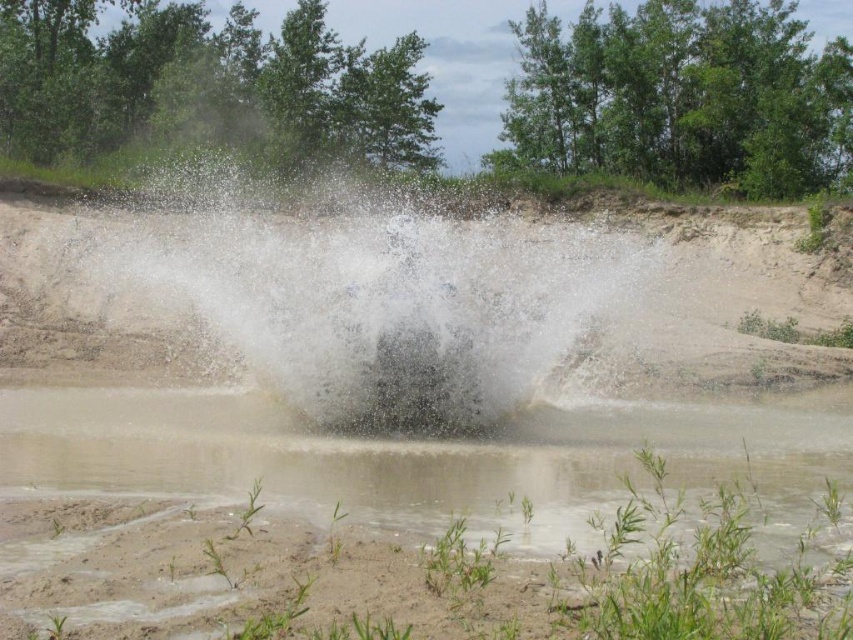
You are standing at the point marked as point (125, 406) in the image. A friend is holding a camera 17.50 meters away from you. Where is your friend standing relative to the scene?

Your friend is standing at the viewer position because the point (125, 406) is 17.50 meters away from the viewer.

You are a photographer trying to capture the splash in the image. You notice the muddy water at center and the white frothy water at center. Which one is smaller in size?

The muddy water at center has a smaller size compared to the white frothy water at center.

You are standing at the edge of the pond and want to reach both the point at coordinates point [701,438] and the point at coordinates point [383,234]. Which point will you reach first as you walk towards them?

You will reach the point at coordinates point [701,438] first because it is closer to you than the point at coordinates point [383,234], which is further away.